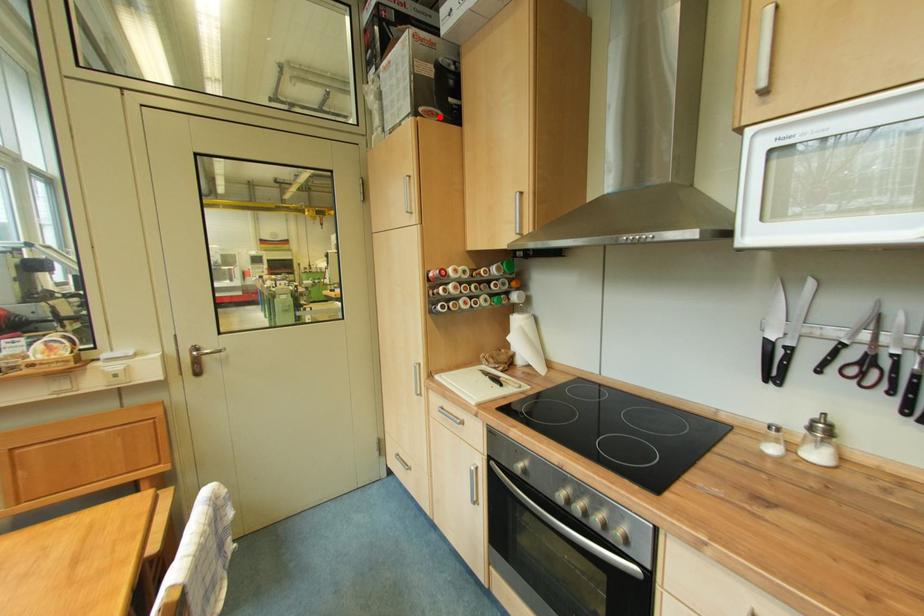
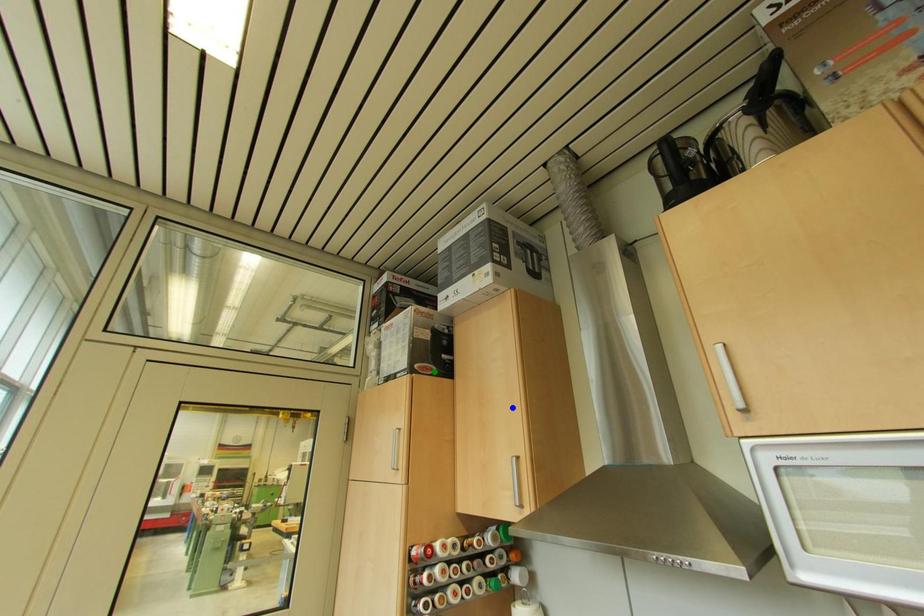
Question: I am providing you with two images of the same scene from different viewpoints. A red point is marked on the first image. You are given multiple points on the second image. Which spot in image 2 lines up with the point in image 1?

Choices:
 (A) yellow point
 (B) blue point
 (C) green point

Answer: (C)